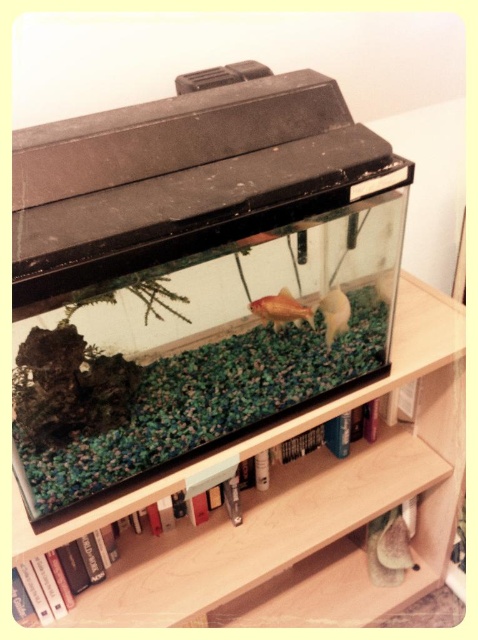
Question: Which point is farther from the camera taking this photo?

Choices:
 (A) (339, 305)
 (B) (264, 310)
 (C) (217, 528)

Answer: (C)

Question: Does goldfish at center have a larger size compared to gold shiny fish at center?

Choices:
 (A) yes
 (B) no

Answer: (A)

Question: Which point appears closest to the camera in this image?

Choices:
 (A) (77, 604)
 (B) (304, 305)

Answer: (B)

Question: Which is nearer to the translucent glass bookshelf at center?

Choices:
 (A) goldfish at center
 (B) gold shiny fish at center

Answer: (B)

Question: Does goldfish at center have a lesser width compared to gold shiny fish at center?

Choices:
 (A) no
 (B) yes

Answer: (A)

Question: From the image, what is the correct spatial relationship of goldfish at center in relation to gold shiny fish at center?

Choices:
 (A) left
 (B) right

Answer: (A)